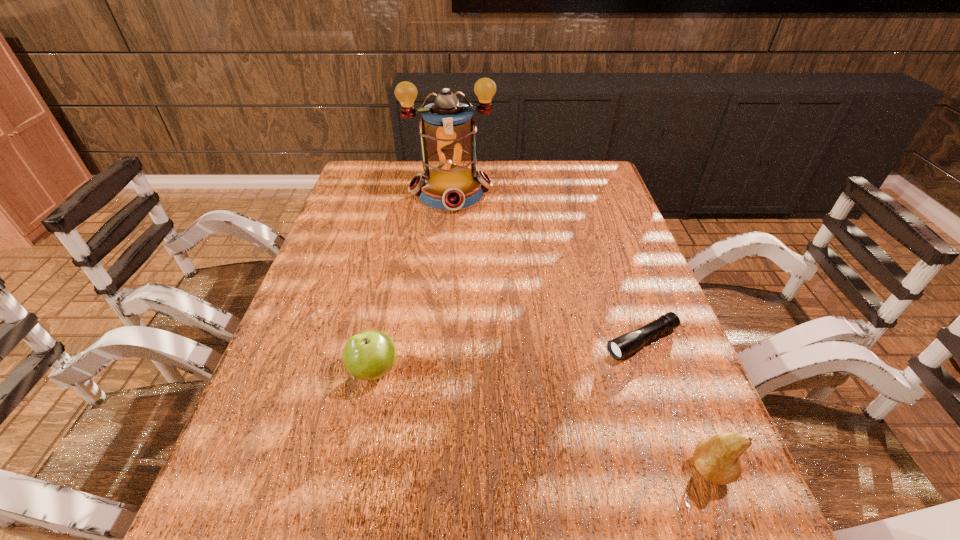
In the image, there is a desktop. Where is `vacant space at the right edge`? vacant space at the right edge is located at coordinates (633, 246).

I want to click on free space at the far left corner of the desktop, so click(x=391, y=187).

The width and height of the screenshot is (960, 540). In the image, there is a desktop. Find the location of `vacant space at the far right corner`. vacant space at the far right corner is located at coordinates (583, 190).

The width and height of the screenshot is (960, 540). Find the location of `free area in between the shortest object and the tallest object`. free area in between the shortest object and the tallest object is located at coordinates (546, 266).

I want to click on free area in between the apple and the lantern, so click(413, 281).

Locate an element on the screen. This screenshot has width=960, height=540. free space between the farthest object and the shortest object is located at coordinates (546, 266).

The width and height of the screenshot is (960, 540). What are the coordinates of `free spot between the apple and the lantern` in the screenshot? It's located at click(x=413, y=281).

Locate an element on the screen. vacant area that lies between the apple and the tallest object is located at coordinates (413, 281).

You are a GUI agent. You are given a task and a screenshot of the screen. Output one action in this format:
    pyautogui.click(x=<x>, y=<y>)
    Task: Click on the blank region between the apple and the nearest object
    
    Given the screenshot: What is the action you would take?
    pyautogui.click(x=542, y=420)

Where is `free spot between the farthest object and the flashlight`? This screenshot has width=960, height=540. free spot between the farthest object and the flashlight is located at coordinates (546, 266).